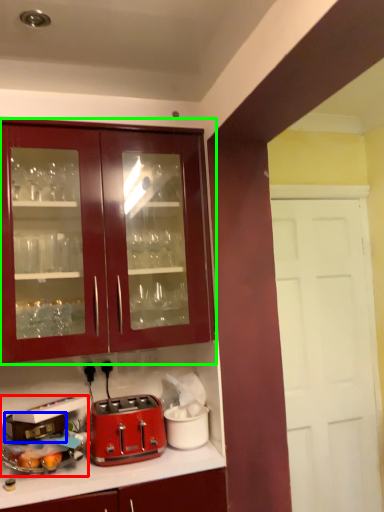
Question: Which object is positioned closest to appliance (highlighted by a red box)? Select from appliance (highlighted by a blue box) and cabinetry (highlighted by a green box).

Choices:
 (A) appliance
 (B) cabinetry

Answer: (A)